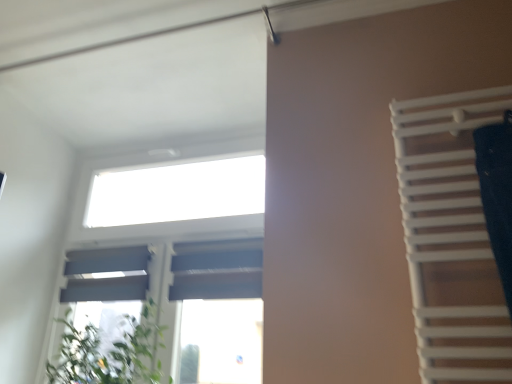
Question: Should I look upward or downward to see white matte window at upper center?

Choices:
 (A) down
 (B) up

Answer: (A)